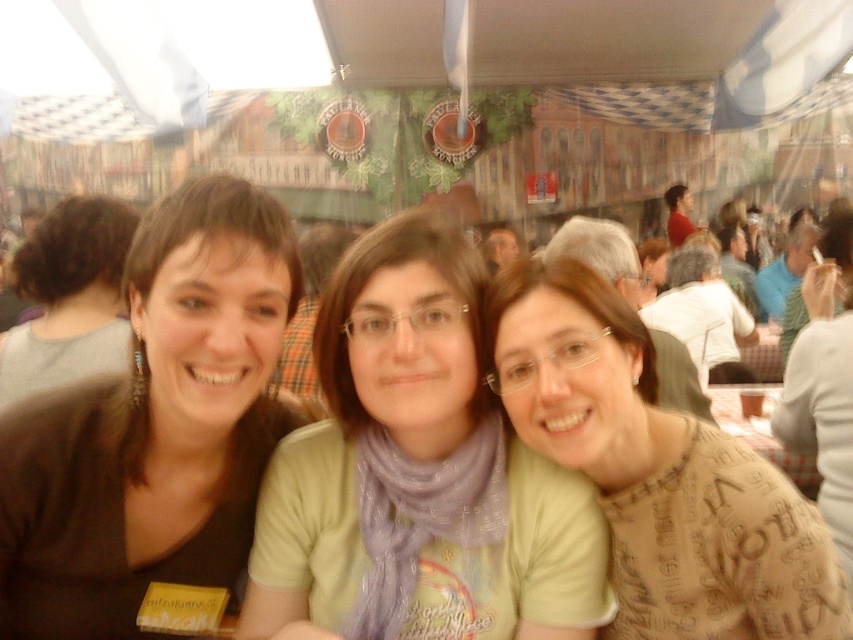
Question: Where is light green t-shirt at center located in relation to brown hair at left in the image?

Choices:
 (A) above
 (B) below

Answer: (B)

Question: Does brown hair at left have a lesser width compared to matte red shirt at center?

Choices:
 (A) yes
 (B) no

Answer: (B)

Question: Which point is closer to the camera?

Choices:
 (A) (711, 580)
 (B) (666, 198)
 (C) (74, 336)

Answer: (A)

Question: Based on their relative distances, which object is farther from the brown matte shirt at left?

Choices:
 (A) brown printed sweater at center
 (B) light green t-shirt at center
 (C) matte red shirt at center
 (D) brown hair at left

Answer: (C)

Question: Among these objects, which one is farthest from the camera?

Choices:
 (A) light green t-shirt at center
 (B) brown matte shirt at left

Answer: (A)

Question: Is brown hair at left to the right of matte red shirt at center from the viewer's perspective?

Choices:
 (A) no
 (B) yes

Answer: (A)